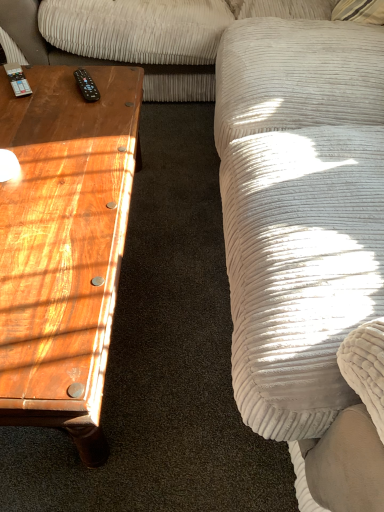
The width and height of the screenshot is (384, 512). Describe the element at coordinates (64, 245) in the screenshot. I see `wooden coffee table at left` at that location.

Measure the distance between wooden coffee table at left and camera.

27.62 inches.

Find the location of a particular element. The image size is (384, 512). wooden coffee table at left is located at coordinates (64, 245).

Where is `black plastic remote at upper left`? Image resolution: width=384 pixels, height=512 pixels. black plastic remote at upper left is located at coordinates (86, 86).

What is the approximate height of black plastic remote at upper left?

The height of black plastic remote at upper left is 1.25 inches.

What do you see at coordinates (86, 86) in the screenshot? I see `black plastic remote at upper left` at bounding box center [86, 86].

Find the location of `wooden coffee table at left`. wooden coffee table at left is located at coordinates (64, 245).

In the image, is black plastic remote at upper left on the left side or the right side of wooden coffee table at left?

Clearly, black plastic remote at upper left is on the right of wooden coffee table at left in the image.

Is black plastic remote at upper left closer to the viewer compared to wooden coffee table at left?

No, black plastic remote at upper left is behind wooden coffee table at left.

Does point (81, 76) come in front of point (114, 262)?

No, (81, 76) is behind (114, 262).

From the image's perspective, would you say black plastic remote at upper left is shown under wooden coffee table at left?

No, from the image's perspective, black plastic remote at upper left is not below wooden coffee table at left.

From a real-world perspective, which is physically below, black plastic remote at upper left or wooden coffee table at left?

wooden coffee table at left.

Can you confirm if black plastic remote at upper left is wider than wooden coffee table at left?

Incorrect, the width of black plastic remote at upper left does not surpass that of wooden coffee table at left.

From their relative heights in the image, would you say black plastic remote at upper left is taller or shorter than wooden coffee table at left?

black plastic remote at upper left is shorter than wooden coffee table at left.

Can you confirm if black plastic remote at upper left is bigger than wooden coffee table at left?

No.

Is black plastic remote at upper left situated inside wooden coffee table at left or outside?

black plastic remote at upper left can be found inside wooden coffee table at left.

Can you see black plastic remote at upper left touching wooden coffee table at left?

black plastic remote at upper left and wooden coffee table at left are not in contact.

Does black plastic remote at upper left turn towards wooden coffee table at left?

No, black plastic remote at upper left is not facing towards wooden coffee table at left.

How many degrees apart are the facing directions of black plastic remote at upper left and wooden coffee table at left?

The angle between the facing direction of black plastic remote at upper left and the facing direction of wooden coffee table at left is 64.6 degrees.

How much distance is there between black plastic remote at upper left and wooden coffee table at left?

black plastic remote at upper left and wooden coffee table at left are 14.88 inches apart from each other.

In the image, there is a black plastic remote at upper left. At what (x,y) coordinates should I click in order to perform the action: click on coffee table below it (from the image's perspective). Please return your answer as a coordinate pair (x, y). The width and height of the screenshot is (384, 512). Looking at the image, I should click on (64, 245).

Which object is positioned more to the right, wooden coffee table at left or black plastic remote at upper left?

black plastic remote at upper left is more to the right.

Is the depth of wooden coffee table at left greater than that of black plastic remote at upper left?

No, wooden coffee table at left is closer to the camera.

Is point (57, 229) farther from viewer compared to point (99, 94)?

No, (57, 229) is in front of (99, 94).

From the image's perspective, who appears lower, wooden coffee table at left or black plastic remote at upper left?

wooden coffee table at left is shown below in the image.

From a real-world perspective, which object stands above the other?

black plastic remote at upper left, from a real-world perspective.

Is wooden coffee table at left wider than black plastic remote at upper left?

Yes, wooden coffee table at left is wider than black plastic remote at upper left.

Considering the relative sizes of wooden coffee table at left and black plastic remote at upper left in the image provided, is wooden coffee table at left shorter than black plastic remote at upper left?

No.

Can you confirm if wooden coffee table at left is bigger than black plastic remote at upper left?

Yes.

Would you say wooden coffee table at left contains black plastic remote at upper left?

That's correct, black plastic remote at upper left is inside wooden coffee table at left.

Are wooden coffee table at left and black plastic remote at upper left beside each other?

No, wooden coffee table at left is not making contact with black plastic remote at upper left.

Consider the image. Is wooden coffee table at left turned away from black plastic remote at upper left?

No.

Where is `coffee table on the left of the black plastic remote at upper left`? coffee table on the left of the black plastic remote at upper left is located at coordinates (64, 245).

At what (x,y) coordinates should I click in order to perform the action: click on coffee table below the black plastic remote at upper left (from a real-world perspective). Please return your answer as a coordinate pair (x, y). This screenshot has height=512, width=384. Looking at the image, I should click on (64, 245).

Image resolution: width=384 pixels, height=512 pixels. I want to click on remote above the wooden coffee table at left (from a real-world perspective), so click(x=86, y=86).